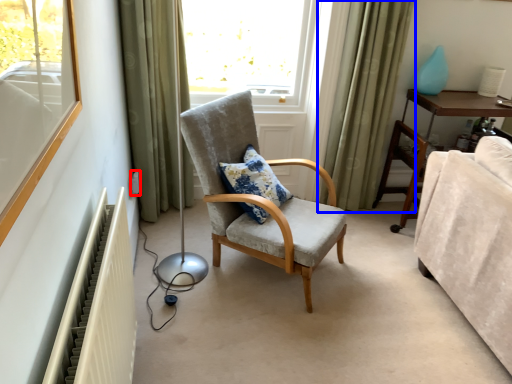
Question: Which point is closer to the camera, electric outlet (highlighted by a red box) or curtain (highlighted by a blue box)?

Choices:
 (A) electric outlet
 (B) curtain

Answer: (B)